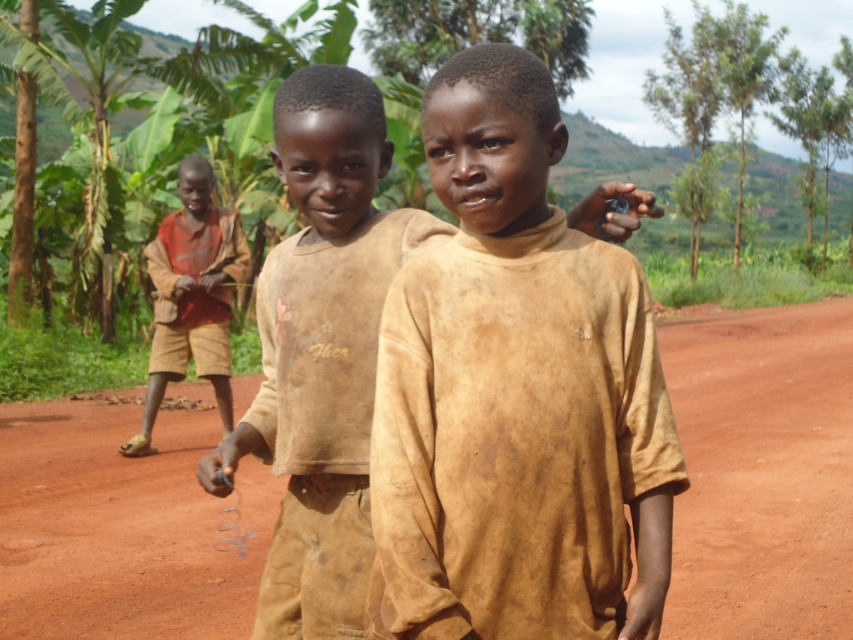
You are a photographer trying to capture the exact position of the brown matte shirt at center in this rural scene. Based on the coordinates provided, can you determine whether the shirt is positioned closer to the top or bottom of the image?

The 2D location of brown matte shirt at center is at point 0.605 on the y axis, which is closer to the bottom of the image since lower y values are closer to the bottom.

You are a photographer trying to capture a group photo of the two boys in the scene. The photographer wants to ensure both boys are fully visible in the frame. Given that the brown matte shirt at center is shorter than the brown cotton shirt at center, which boy should you position closer to the front to avoid blocking the other?

The photographer should position the boy with the brown matte shirt at center closer to the front since it has a lesser height compared to the brown cotton shirt at center, ensuring both are visible without obstruction.

You are a photographer trying to capture the brown matte shirt at center in the image. According to the coordinates provided, where exactly should you focus your camera lens to ensure the shirt is in the center of the frame?

The brown matte shirt at center is located at point 0.616 on the x axis and 0.605 on the y axis, so you should focus your camera lens at those coordinates to center it in the frame.